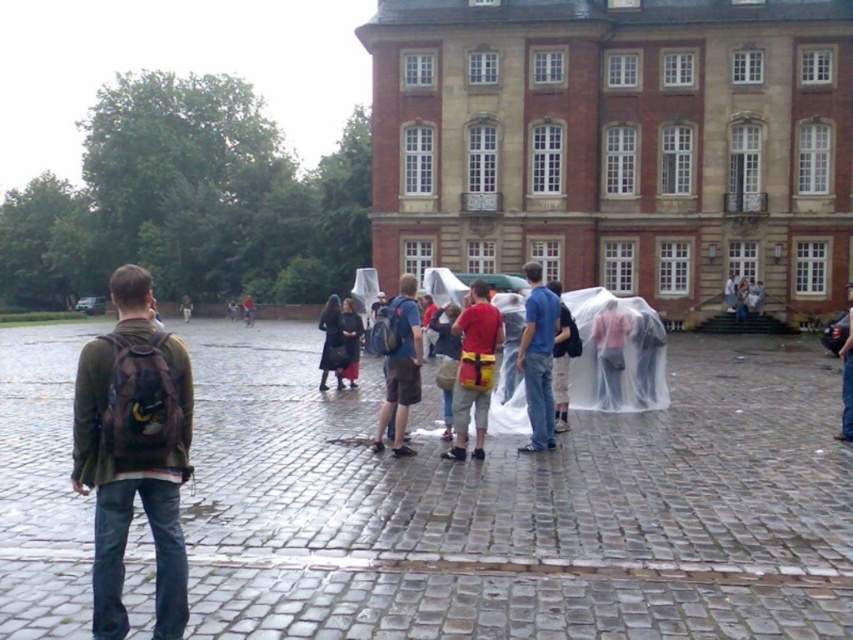
Question: Can you confirm if blue backpack at center is thinner than dark blue coat at center?

Choices:
 (A) no
 (B) yes

Answer: (B)

Question: Which point is farther to the camera?

Choices:
 (A) (329, 342)
 (B) (351, 337)

Answer: (B)

Question: Which point is closer to the camera taking this photo?

Choices:
 (A) (335, 323)
 (B) (361, 326)
 (C) (544, 129)
 (D) (82, 449)

Answer: (D)

Question: Which object is the closest to the dark blue coat at center?

Choices:
 (A) red brick palace at center
 (B) blue fabric umbrella at center
 (C) jeans at center

Answer: (B)

Question: Where is green matte jacket at left located in relation to red fabric backpack at center in the image?

Choices:
 (A) right
 (B) left

Answer: (B)

Question: Is dark gray fabric coat at center thinner than jeans at center?

Choices:
 (A) yes
 (B) no

Answer: (A)